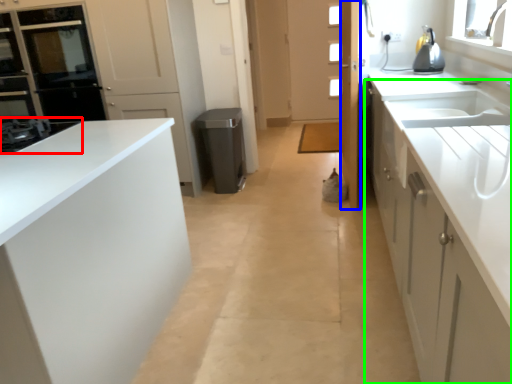
Question: Based on their relative distances, which object is nearer to home appliance (highlighted by a red box)? Choose from door (highlighted by a blue box) and cabinetry (highlighted by a green box).

Choices:
 (A) door
 (B) cabinetry

Answer: (B)